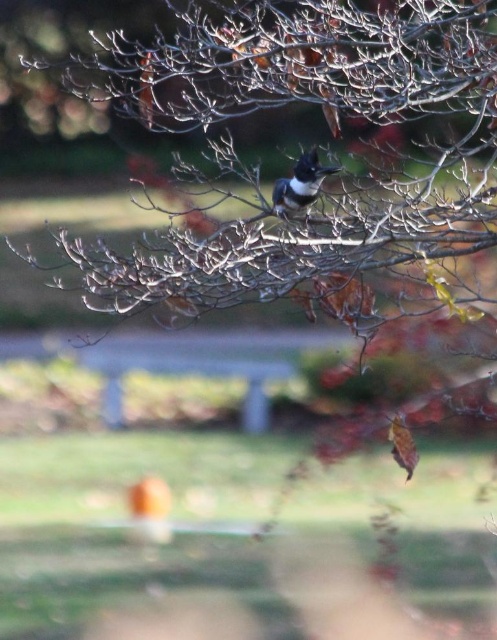
Between brown matte branch at upper center and wooden park bench at center, which one appears on the left side from the viewer's perspective?

wooden park bench at center

Is brown matte branch at upper center to the left of wooden park bench at center from the viewer's perspective?

Incorrect, brown matte branch at upper center is not on the left side of wooden park bench at center.

Which is behind, point (281, 42) or point (102, 403)?

Point (102, 403)

Locate an element on the screen. This screenshot has width=497, height=640. brown matte branch at upper center is located at coordinates click(x=303, y=61).

Which is in front, point (219, 353) or point (283, 198)?

Point (283, 198) is in front.

Can you confirm if wooden park bench at center is positioned below shiny black bird at center?

Yes, wooden park bench at center is below shiny black bird at center.

Describe the element at coordinates (195, 364) in the screenshot. The height and width of the screenshot is (640, 497). I see `wooden park bench at center` at that location.

You are a GUI agent. You are given a task and a screenshot of the screen. Output one action in this format:
    pyautogui.click(x=<x>, y=<y>)
    Task: Click on the wooden park bench at center
    
    Given the screenshot: What is the action you would take?
    point(195,364)

Looking at this image, between brown matte branch at upper center and shiny black bird at center, which one appears on the right side from the viewer's perspective?

From the viewer's perspective, shiny black bird at center appears more on the right side.

Does point (182, 76) come behind point (335, 170)?

Yes, point (182, 76) is farther from viewer.

Locate an element on the screen. The width and height of the screenshot is (497, 640). brown matte branch at upper center is located at coordinates (303, 61).